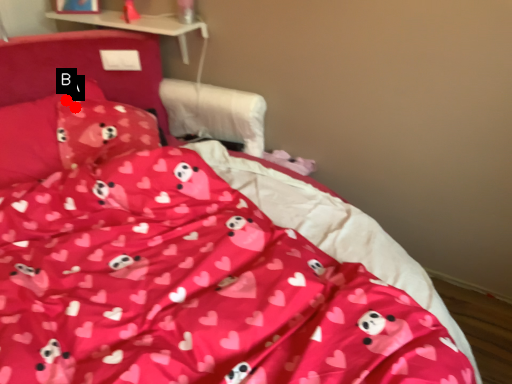
Question: Two points are circled on the image, labeled by A and B beside each circle. Among these points, which one is nearest to the camera?

Choices:
 (A) A is closer
 (B) B is closer

Answer: (A)